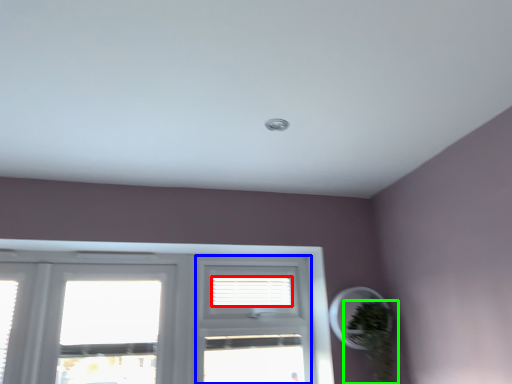
Question: Which object is the farthest from blind (highlighted by a red box)? Choose among these: screen door (highlighted by a blue box) or houseplant (highlighted by a green box).

Choices:
 (A) screen door
 (B) houseplant

Answer: (B)